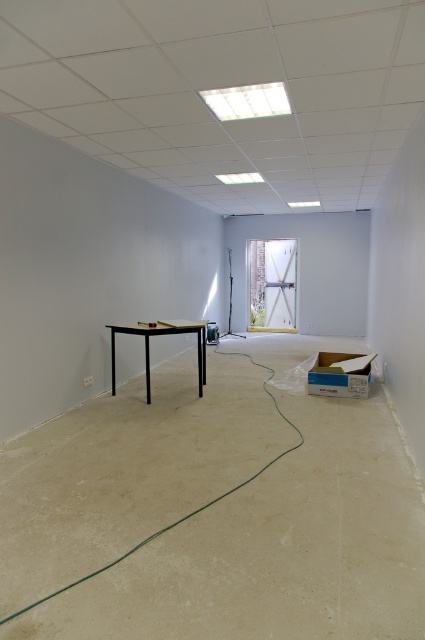
Does clear glass window at center appear over transparent glass window at upper center?

No, clear glass window at center is not above transparent glass window at upper center.

Describe the element at coordinates (272, 284) in the screenshot. The height and width of the screenshot is (640, 425). I see `clear glass window at center` at that location.

Identify the location of clear glass window at center. [x=272, y=284].

Which is more to the right, clear glass window at center or black matte table at center?

clear glass window at center is more to the right.

Between point (286, 282) and point (147, 365), which one is positioned behind?

Point (286, 282)

Does point (291, 282) lie behind point (175, 324)?

Yes.

Where is `clear glass window at center`? The image size is (425, 640). clear glass window at center is located at coordinates (272, 284).

Is transparent glass window at upper center taller than black matte table at center?

In fact, transparent glass window at upper center may be shorter than black matte table at center.

Does point (274, 100) come behind point (147, 392)?

No, it is not.

You are a GUI agent. You are given a task and a screenshot of the screen. Output one action in this format:
    pyautogui.click(x=<x>, y=<y>)
    Task: Click on the transparent glass window at upper center
    The width and height of the screenshot is (425, 640).
    Given the screenshot: What is the action you would take?
    pyautogui.click(x=248, y=100)

What are the coordinates of `transparent glass window at upper center` in the screenshot? It's located at (248, 100).